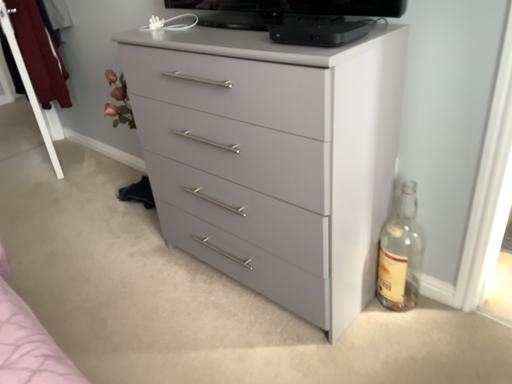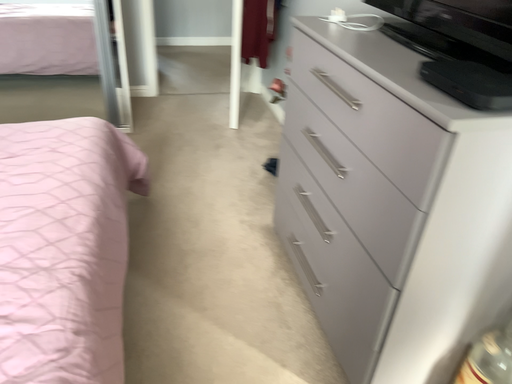
Question: Which way did the camera rotate in the video?

Choices:
 (A) rotated left
 (B) rotated right

Answer: (A)